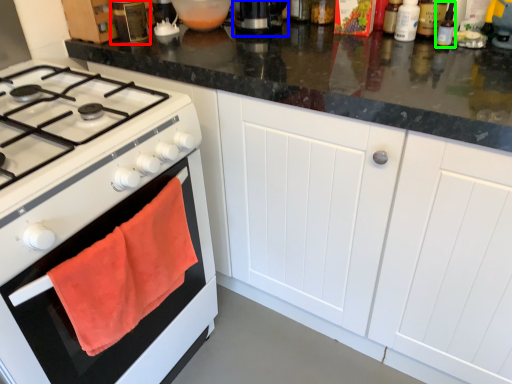
Question: Which object is the farthest from kitchen appliance (highlighted by a red box)? Choose among these: coffee machine (highlighted by a blue box) or bottle (highlighted by a green box).

Choices:
 (A) coffee machine
 (B) bottle

Answer: (B)